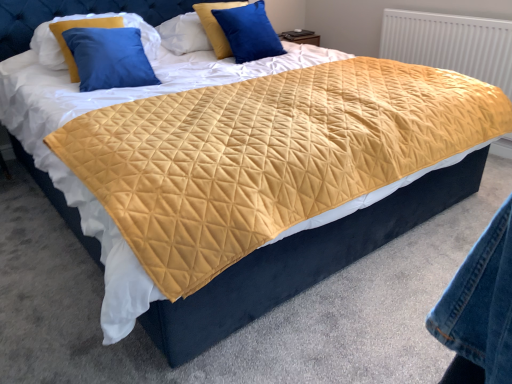
Where is `empty space that is ontop of white textured radiator at upper right (from a real-world perspective)`? The width and height of the screenshot is (512, 384). empty space that is ontop of white textured radiator at upper right (from a real-world perspective) is located at coordinates (448, 8).